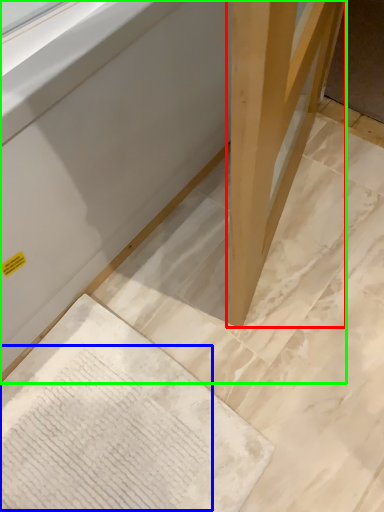
Question: Considering the real-world distances, which object is closest to wood (highlighted by a red box)? writing (highlighted by a blue box) or furniture (highlighted by a green box).

Choices:
 (A) writing
 (B) furniture

Answer: (B)